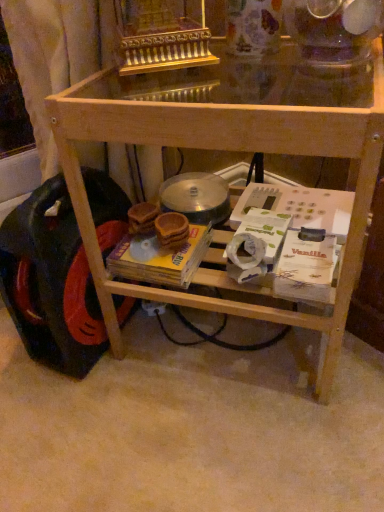
Question: Looking at their shapes, would you say natural wood table at center is wider or thinner than yellow cardboard magazine at center?

Choices:
 (A) thin
 (B) wide

Answer: (B)

Question: Considering their positions, is natural wood table at center located in front of or behind yellow cardboard magazine at center?

Choices:
 (A) front
 (B) behind

Answer: (A)

Question: Which object is the closest to the natural wood table at center?

Choices:
 (A) yellow cardboard magazine at center
 (B) black rubber wheel at lower left

Answer: (B)

Question: Which of these objects is positioned closest to the natural wood table at center?

Choices:
 (A) black rubber wheel at lower left
 (B) yellow cardboard magazine at center

Answer: (A)